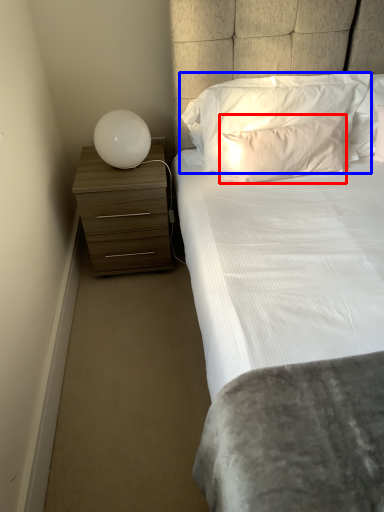
Question: Which object appears farthest to the camera in this image, pillow (highlighted by a red box) or pillow (highlighted by a blue box)?

Choices:
 (A) pillow
 (B) pillow

Answer: (B)